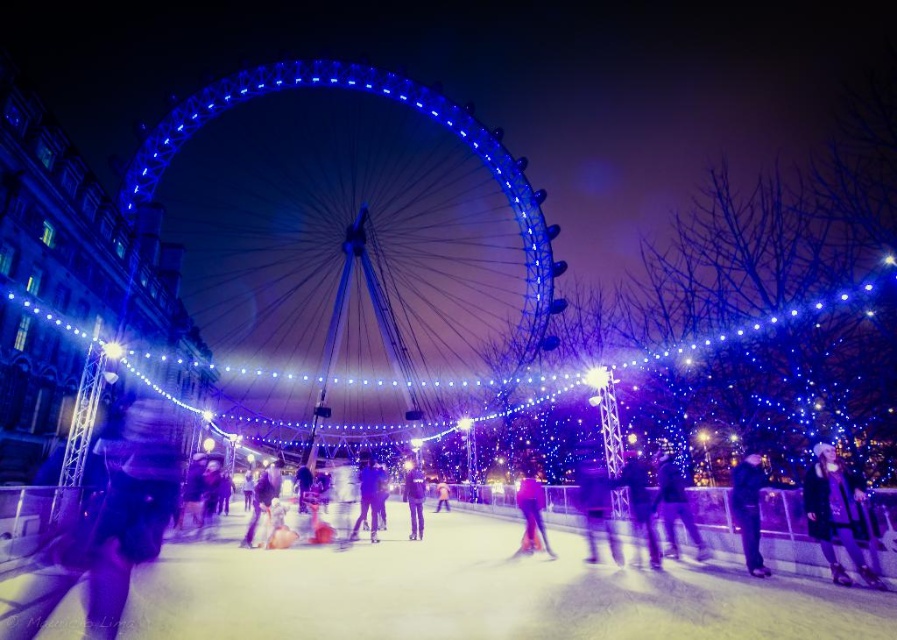
Can you confirm if matte black jacket at center is positioned below pink fabric at center?

No.

Between matte black jacket at center and pink fabric at center, which one appears on the left side from the viewer's perspective?

pink fabric at center

Does point (678, 500) lie behind point (441, 483)?

No, (678, 500) is in front of (441, 483).

Where is `matte black jacket at center`? matte black jacket at center is located at coordinates (675, 506).

Is dark blue jacket at center shorter than smooth black pants at center?

In fact, dark blue jacket at center may be taller than smooth black pants at center.

Can you confirm if dark blue jacket at center is positioned to the right of smooth black pants at center?

Correct, you'll find dark blue jacket at center to the right of smooth black pants at center.

Is point (739, 481) positioned in front of point (377, 500)?

Yes, it is in front of point (377, 500).

Where is `dark blue jacket at center`? The image size is (897, 640). dark blue jacket at center is located at coordinates (749, 508).

Between blue illuminated ferris wheel at center and dark blue jacket at center, which one is positioned higher?

blue illuminated ferris wheel at center is above.

Who is shorter, blue illuminated ferris wheel at center or dark blue jacket at center?

With less height is dark blue jacket at center.

This screenshot has width=897, height=640. What are the coordinates of `blue illuminated ferris wheel at center` in the screenshot? It's located at (350, 246).